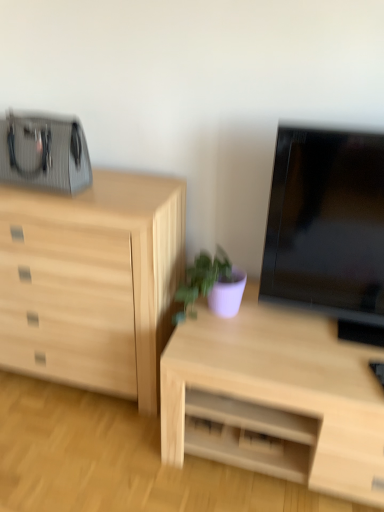
Question: Is purple matte plant at center at the back of natural wood chest of drawers at left?

Choices:
 (A) no
 (B) yes

Answer: (A)

Question: Is natural wood chest of drawers at left positioned far away from purple matte plant at center?

Choices:
 (A) no
 (B) yes

Answer: (A)

Question: Does natural wood chest of drawers at left come behind purple matte plant at center?

Choices:
 (A) yes
 (B) no

Answer: (B)

Question: Is natural wood chest of drawers at left with purple matte plant at center?

Choices:
 (A) no
 (B) yes

Answer: (A)

Question: Considering the relative positions of natural wood chest of drawers at left and purple matte plant at center in the image provided, is natural wood chest of drawers at left to the left of purple matte plant at center from the viewer's perspective?

Choices:
 (A) yes
 (B) no

Answer: (A)

Question: Does natural wood chest of drawers at left have a lesser width compared to purple matte plant at center?

Choices:
 (A) yes
 (B) no

Answer: (B)

Question: Is natural wood chest of drawers at left in front of black glossy tv at right?

Choices:
 (A) no
 (B) yes

Answer: (A)

Question: Is the depth of natural wood chest of drawers at left greater than that of black glossy tv at right?

Choices:
 (A) no
 (B) yes

Answer: (B)

Question: Is natural wood chest of drawers at left at the left side of black glossy tv at right?

Choices:
 (A) yes
 (B) no

Answer: (A)

Question: From the image's perspective, is natural wood chest of drawers at left under black glossy tv at right?

Choices:
 (A) no
 (B) yes

Answer: (B)

Question: From a real-world perspective, is natural wood chest of drawers at left positioned over black glossy tv at right based on gravity?

Choices:
 (A) yes
 (B) no

Answer: (B)

Question: Is natural wood chest of drawers at left positioned with its back to black glossy tv at right?

Choices:
 (A) no
 (B) yes

Answer: (A)

Question: From a real-world perspective, is purple matte plant at center over natural wood chest of drawers at left?

Choices:
 (A) yes
 (B) no

Answer: (A)